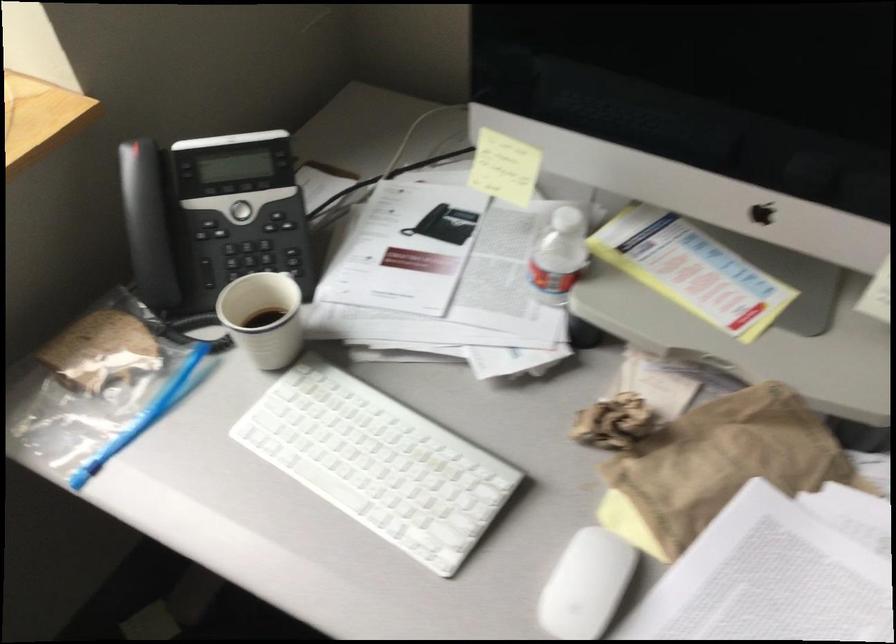
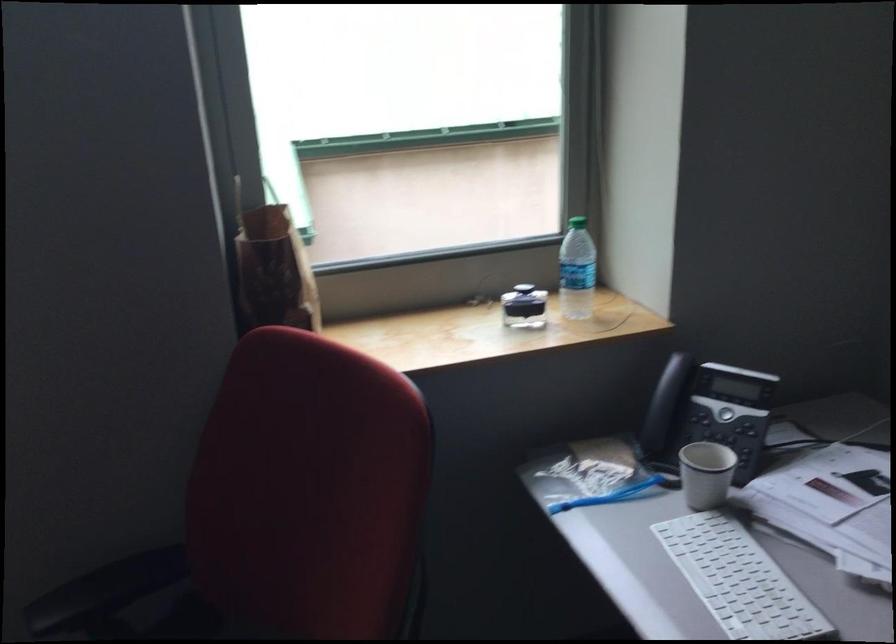
Locate, in the second image, the point that corresponds to (138,410) in the first image.

(607, 495)